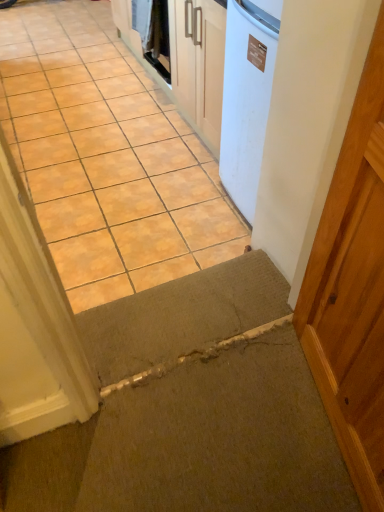
Question: In the image, is brown concrete at center on the left side or the right side of white glossy washing machine at upper center?

Choices:
 (A) left
 (B) right

Answer: (A)

Question: Is brown concrete at center taller or shorter than white glossy washing machine at upper center?

Choices:
 (A) short
 (B) tall

Answer: (A)

Question: Estimate the real-world distances between objects in this image. Which object is farther from the white glossy washing machine at upper center?

Choices:
 (A) brown concrete at center
 (B) carpeted mat at lower center

Answer: (B)

Question: Which is nearer to the white glossy washing machine at upper center?

Choices:
 (A) carpeted mat at lower center
 (B) brown concrete at center

Answer: (B)